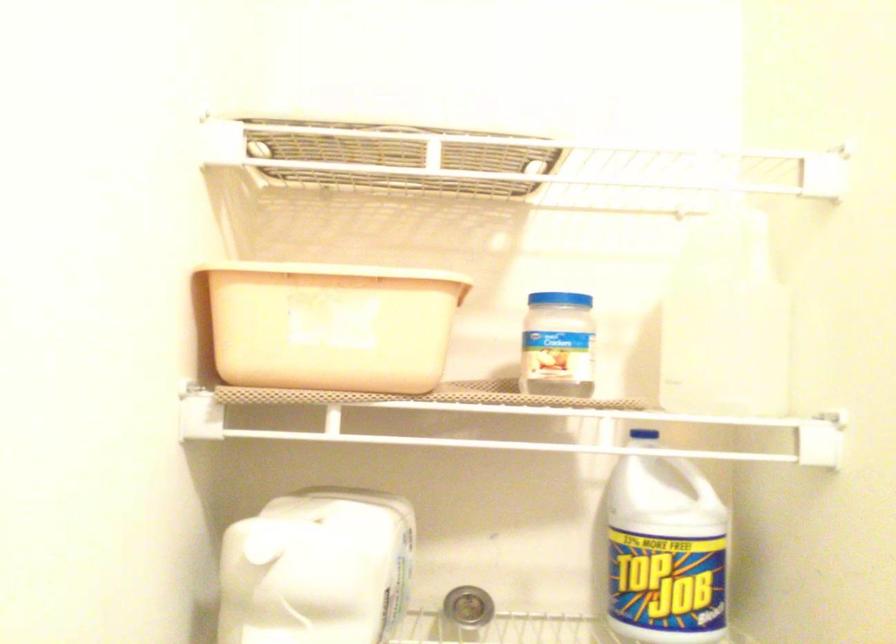
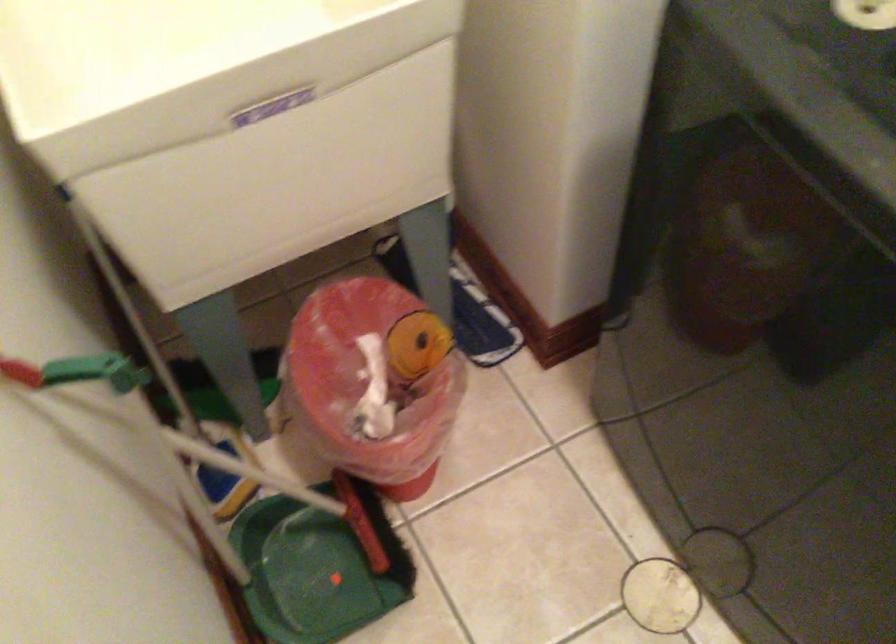
How did the camera likely rotate?

The camera's rotation is toward right-down.